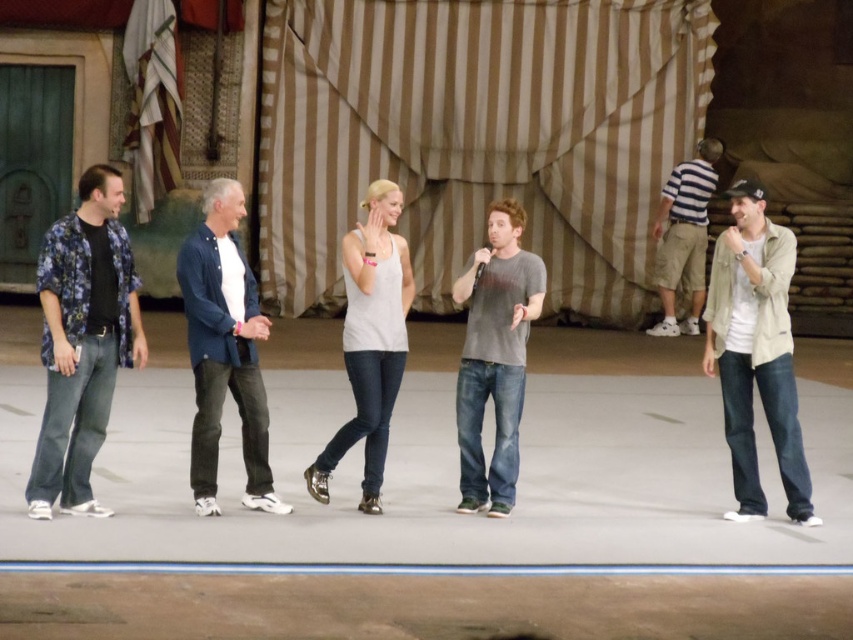
Based on the photo, you are a photographer positioned at the front of the stage. You need to take a closeup shot of the blue denim shirt at center. Where exactly should you aim your camera to capture it perfectly?

To capture the blue denim shirt at center, aim your camera at point coordinates of 0.547 on the x axis and 0.264 on the y axis.

You are a stagehand who needs to place a 10 feet long barrier between the beige cotton jacket at right and the blue denim shirt at center. Is there enough space to place the barrier between them?

The beige cotton jacket at right and blue denim shirt at center are 12.88 feet apart, so yes, the 10 feet long barrier can be placed between them since the distance between them is greater than the barrier length.

You are standing at the front of the stage and want to move to the point marked at point (x=788, y=460). However, there is an obstacle at point (x=241, y=417). Can you reach your destination without passing behind the obstacle?

Point (x=788, y=460) is behind point (x=241, y=417), so you cannot reach the destination without passing behind the obstacle.